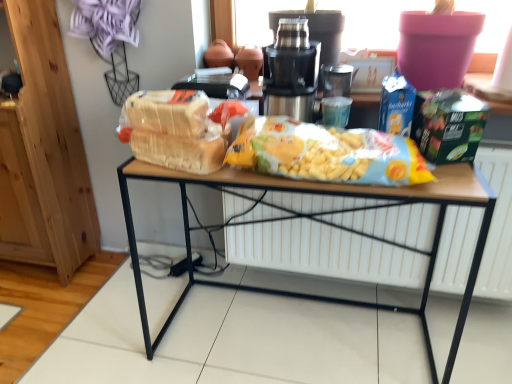
What is the approximate width of white matte radiator at center?

white matte radiator at center is 2.96 inches in width.

What do you see at coordinates (291, 71) in the screenshot? I see `metallic stainless steel juicer at center` at bounding box center [291, 71].

At what (x,y) coordinates should I click in order to perform the action: click on yellow matte cereal at center. Please return your answer as a coordinate pair (x, y). Looking at the image, I should click on (327, 153).

Where is `white matte radiator at center`? The width and height of the screenshot is (512, 384). white matte radiator at center is located at coordinates (323, 253).

Is light brown bread at center aimed at wooden table at center?

No.

Is light brown bread at center not inside wooden table at center?

Yes, light brown bread at center is located beyond the bounds of wooden table at center.

From a real-world perspective, who is located lower, light brown bread at center or wooden table at center?

wooden table at center is physically lower.

Who is smaller, light brown bread at center or wooden table at center?

Smaller between the two is light brown bread at center.

Who is taller, light brown bread at center or white matte radiator at center?

white matte radiator at center.

Considering the sizes of objects light brown bread at center and white matte radiator at center in the image provided, who is wider, light brown bread at center or white matte radiator at center?

light brown bread at center is wider.

Could white matte radiator at center be considered to be inside light brown bread at center?

No.

Is light brown bread at center to the right of white matte radiator at center from the viewer's perspective?

Incorrect, light brown bread at center is not on the right side of white matte radiator at center.

Between wooden table at center and metallic stainless steel juicer at center, which one appears on the left side from the viewer's perspective?

From the viewer's perspective, metallic stainless steel juicer at center appears more on the left side.

Is wooden table at center bigger than metallic stainless steel juicer at center?

Yes, wooden table at center is bigger than metallic stainless steel juicer at center.

Is wooden table at center wider than metallic stainless steel juicer at center?

Correct, the width of wooden table at center exceeds that of metallic stainless steel juicer at center.

Is light brown bread at center at the right side of metallic stainless steel juicer at center?

In fact, light brown bread at center is to the left of metallic stainless steel juicer at center.

Is metallic stainless steel juicer at center at the back of light brown bread at center?

No, light brown bread at center is not facing the opposite direction of metallic stainless steel juicer at center.

From the image's perspective, would you say light brown bread at center is positioned over metallic stainless steel juicer at center?

No, from the image's perspective, light brown bread at center is not above metallic stainless steel juicer at center.

Where is `snack on the left side of metallic stainless steel juicer at center`? The width and height of the screenshot is (512, 384). snack on the left side of metallic stainless steel juicer at center is located at coordinates (174, 130).

Considering the relative sizes of wooden table at center and yellow matte cereal at center in the image provided, is wooden table at center bigger than yellow matte cereal at center?

Yes, wooden table at center is bigger than yellow matte cereal at center.

Where is `desk on the left of yellow matte cereal at center`? desk on the left of yellow matte cereal at center is located at coordinates (331, 196).

From a real-world perspective, is wooden table at center above or below yellow matte cereal at center?

In terms of real-world spatial position, wooden table at center is below yellow matte cereal at center.

From the image's perspective, is wooden table at center above or below yellow matte cereal at center?

Clearly, from the image's perspective, wooden table at center is below yellow matte cereal at center.

From a real-world perspective, is white matte radiator at center positioned over yellow matte cereal at center based on gravity?

No, from a real-world perspective, white matte radiator at center is not on top of yellow matte cereal at center.

Considering the sizes of objects white matte radiator at center and yellow matte cereal at center in the image provided, who is wider, white matte radiator at center or yellow matte cereal at center?

yellow matte cereal at center.

Is white matte radiator at center to the left of yellow matte cereal at center from the viewer's perspective?

No, white matte radiator at center is not to the left of yellow matte cereal at center.

Does metallic stainless steel juicer at center come behind white matte radiator at center?

No, metallic stainless steel juicer at center is closer to the viewer.

Considering the sizes of objects metallic stainless steel juicer at center and white matte radiator at center in the image provided, who is shorter, metallic stainless steel juicer at center or white matte radiator at center?

metallic stainless steel juicer at center is shorter.

From a real-world perspective, is metallic stainless steel juicer at center located higher than white matte radiator at center?

Yes, from a real-world perspective, metallic stainless steel juicer at center is on top of white matte radiator at center.

Considering the points (278, 102) and (352, 279), which point is in front, point (278, 102) or point (352, 279)?

The point (278, 102) is closer to the camera.

This screenshot has width=512, height=384. Identify the location of snack behind the wooden table at center. (174, 130).

Find the location of a particular element. The height and width of the screenshot is (384, 512). radiator below the light brown bread at center (from a real-world perspective) is located at coordinates (323, 253).

From the image, which object appears to be farther from metallic stainless steel juicer at center, yellow matte cereal at center or white matte radiator at center?

Among the two, white matte radiator at center is located further to metallic stainless steel juicer at center.

Considering their positions, is white matte radiator at center positioned closer to metallic stainless steel juicer at center than light brown bread at center?

light brown bread at center.

Based on their spatial positions, is white matte radiator at center or wooden table at center further from light brown bread at center?

white matte radiator at center.

Estimate the real-world distances between objects in this image. Which object is closer to white matte radiator at center, metallic stainless steel juicer at center or wooden table at center?

wooden table at center.

Based on their spatial positions, is light brown bread at center or wooden table at center further from metallic stainless steel juicer at center?

wooden table at center is positioned further to the anchor metallic stainless steel juicer at center.

Estimate the real-world distances between objects in this image. Which object is closer to metallic stainless steel juicer at center, yellow matte cereal at center or light brown bread at center?

yellow matte cereal at center is closer to metallic stainless steel juicer at center.

When comparing their distances from metallic stainless steel juicer at center, does wooden table at center or white matte radiator at center seem closer?

wooden table at center is closer to metallic stainless steel juicer at center.

Estimate the real-world distances between objects in this image. Which object is closer to white matte radiator at center, metallic stainless steel juicer at center or yellow matte cereal at center?

yellow matte cereal at center is closer to white matte radiator at center.

The width and height of the screenshot is (512, 384). I want to click on cereal between light brown bread at center and white matte radiator at center from left to right, so click(327, 153).

This screenshot has width=512, height=384. What are the coordinates of `cereal between metallic stainless steel juicer at center and white matte radiator at center in the up-down direction` in the screenshot? It's located at (327, 153).

Locate an element on the screen. The height and width of the screenshot is (384, 512). desk between light brown bread at center and yellow matte cereal at center in the horizontal direction is located at coordinates (331, 196).

This screenshot has height=384, width=512. I want to click on tableware between light brown bread at center and yellow matte cereal at center from left to right, so click(x=291, y=71).